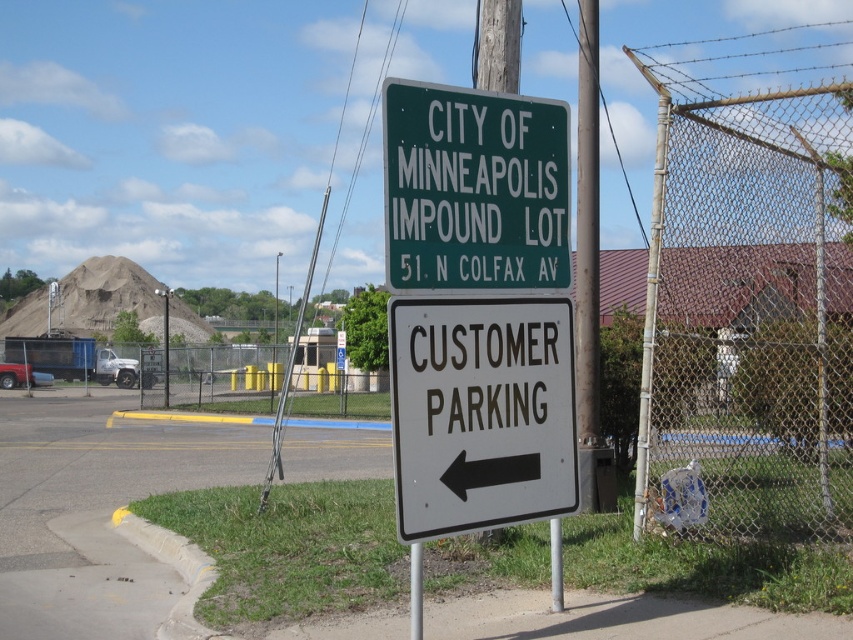
You are a delivery driver who needs to park your truck in the customer parking area. You see the green metal sign at upper center and the wire mesh fence at right. Which object is wider in the scene?

The wire mesh fence at right is wider than the green metal sign at upper center.

You are standing in front of the two signs on the grassy patch. Which of the two points, point (560,353) or point (537,204), is closer to you?

Point (560,353) is closer to you because it is further to the viewer than point (537,204).